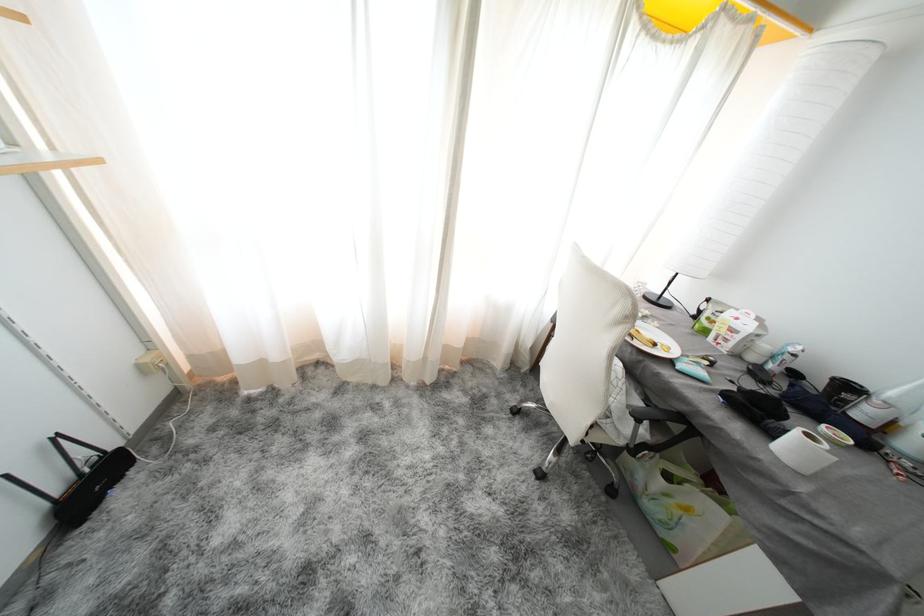
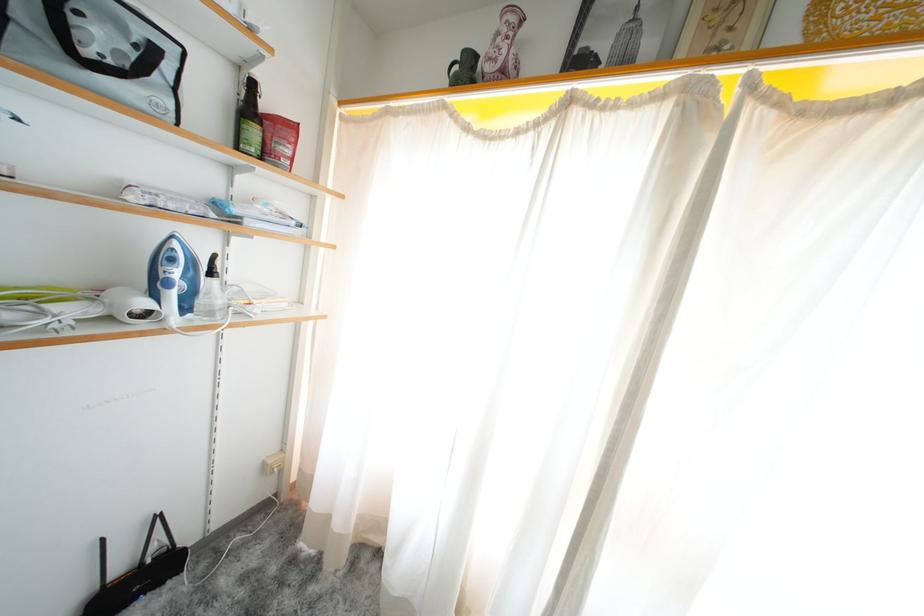
The first image is from the beginning of the video and the second image is from the end. How did the camera likely rotate when shooting the video?

The rotation direction of the camera is left-up.